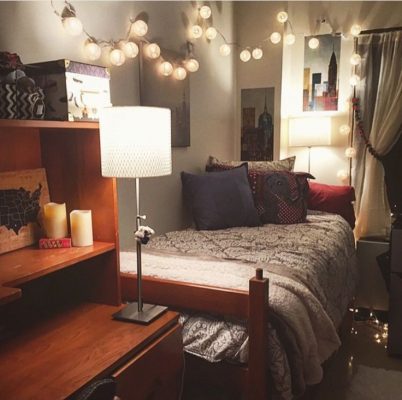
This screenshot has height=400, width=402. I want to click on desk, so [x=114, y=346].